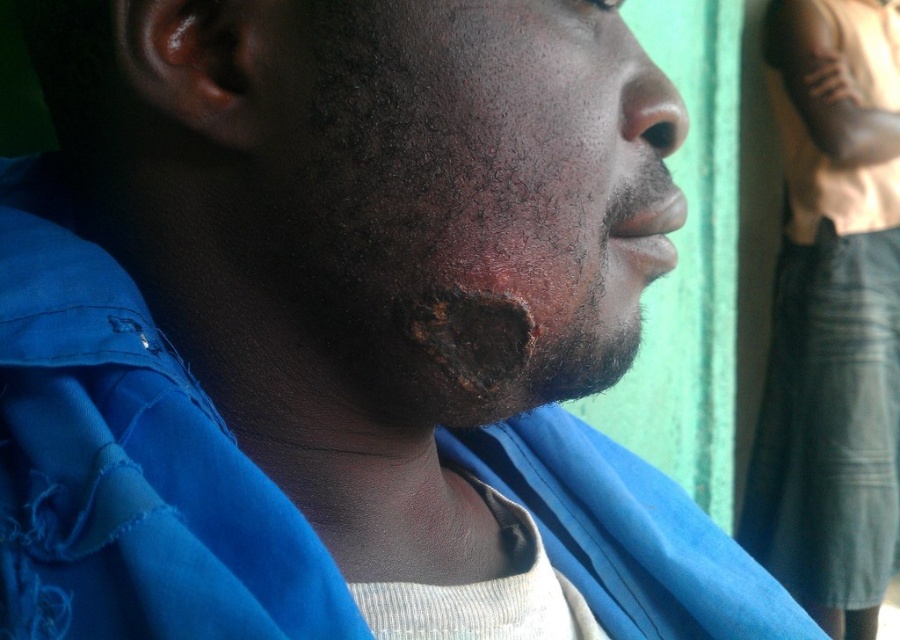
Question: Which is nearer to the dark blue fabric at center?

Choices:
 (A) smooth skin nose at center
 (B) dry skin at center

Answer: (A)

Question: From the image, what is the correct spatial relationship of dry skin at center in relation to dark blue fabric at center?

Choices:
 (A) above
 (B) below

Answer: (A)

Question: Which object appears closest to the camera in this image?

Choices:
 (A) smooth skin nose at center
 (B) dark blue fabric at center

Answer: (A)

Question: Is dry skin at center wider than dark blue fabric at center?

Choices:
 (A) yes
 (B) no

Answer: (B)

Question: Which of the following is the farthest from the observer?

Choices:
 (A) (896, 269)
 (B) (469, 205)
 (C) (658, 156)

Answer: (A)

Question: Is the position of dry skin at center less distant than that of smooth skin nose at center?

Choices:
 (A) no
 (B) yes

Answer: (B)